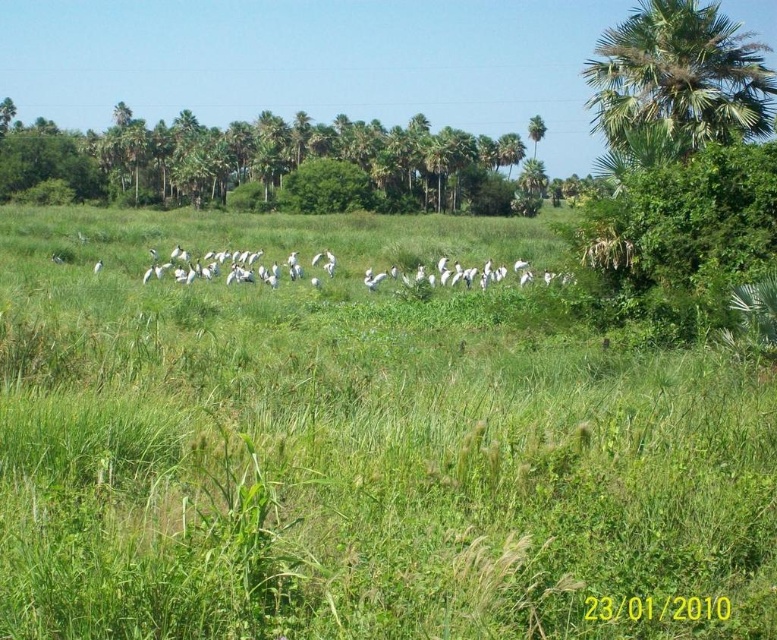
Which of these two, green grassy at center or white matte bird at center, stands shorter?

Standing shorter between the two is white matte bird at center.

Is green grassy at center further to camera compared to white matte bird at center?

No, it is not.

Is point (755, 593) positioned behind point (98, 264)?

No, it is not.

Identify the location of green grassy at center. This screenshot has height=640, width=777. (359, 445).

Consider the image. Is the position of green leafy palm tree at upper right less distant than that of white matte bird at center?

Yes.

The height and width of the screenshot is (640, 777). What do you see at coordinates (678, 77) in the screenshot? I see `green leafy palm tree at upper right` at bounding box center [678, 77].

Which is behind, point (619, 129) or point (100, 264)?

Point (100, 264)

At what (x,y) coordinates should I click in order to perform the action: click on green leafy palm tree at upper right. Please return your answer as a coordinate pair (x, y). This screenshot has width=777, height=640. Looking at the image, I should click on (678, 77).

Is green leafy trees at upper left thinner than white matte bird at center?

Incorrect, green leafy trees at upper left's width is not less than white matte bird at center's.

Is point (269, 196) in front of point (96, 260)?

No, (269, 196) is behind (96, 260).

Find the location of a particular element. This screenshot has width=777, height=640. green leafy trees at upper left is located at coordinates (260, 163).